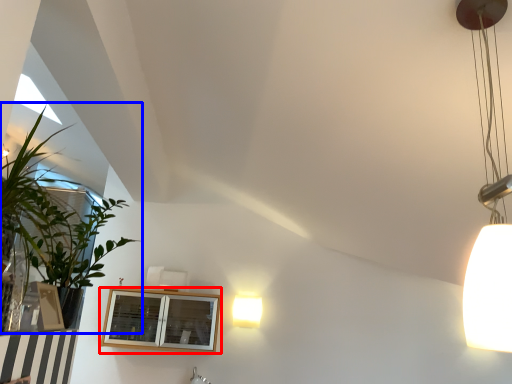
Question: Which point is closer to the camera, window (highlighted by a red box) or houseplant (highlighted by a blue box)?

Choices:
 (A) window
 (B) houseplant

Answer: (B)